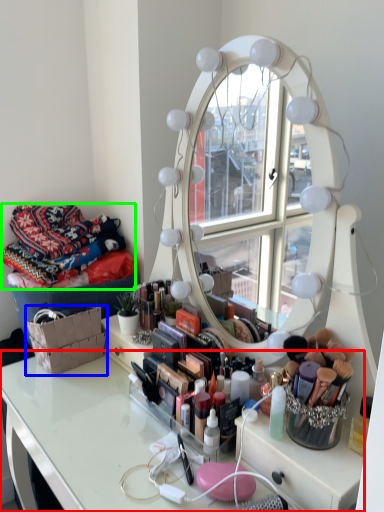
Question: Based on their relative distances, which object is nearer to table (highlighted by a red box)? Choose from basket (highlighted by a blue box) and material (highlighted by a green box).

Choices:
 (A) basket
 (B) material

Answer: (A)